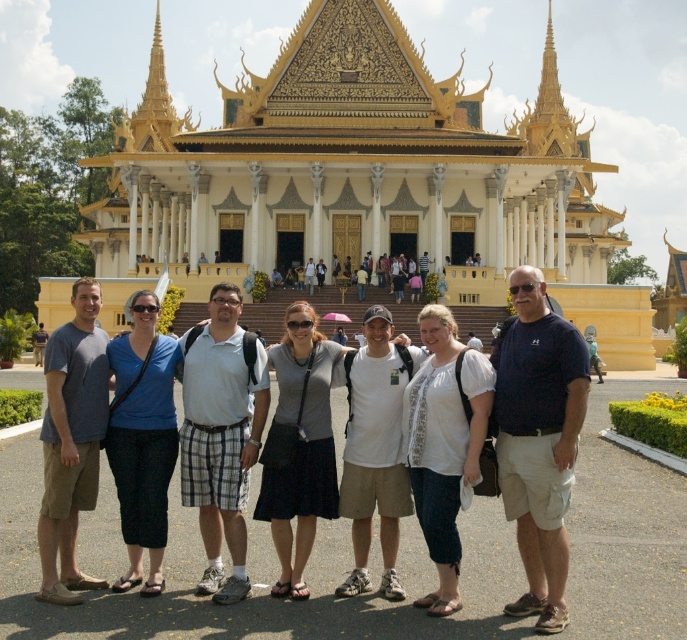
Does gold/golden/temple at center lie in front of matte blue shirt at center?

No, gold/golden/temple at center is behind matte blue shirt at center.

Measure the distance from gold/golden/temple at center to matte blue shirt at center.

gold/golden/temple at center and matte blue shirt at center are 60.02 meters apart.

Is point (172, 138) less distant than point (122, 364)?

No, (172, 138) is behind (122, 364).

This screenshot has height=640, width=687. I want to click on gold/golden/temple at center, so click(x=361, y=179).

Which is more to the right, gold/golden/temple at center or white cotton shirt at center?

From the viewer's perspective, white cotton shirt at center appears more on the right side.

Based on the photo, which of these two, gold/golden/temple at center or white cotton shirt at center, stands taller?

Standing taller between the two is gold/golden/temple at center.

I want to click on gold/golden/temple at center, so click(x=361, y=179).

The height and width of the screenshot is (640, 687). I want to click on gold/golden/temple at center, so click(361, 179).

Is white cotton shirt at center bigger than matte gray shirt at center?

No.

Is white cotton shirt at center smaller than matte gray shirt at center?

Yes, white cotton shirt at center is smaller than matte gray shirt at center.

Describe the element at coordinates (444, 444) in the screenshot. I see `white cotton shirt at center` at that location.

Where is `white cotton shirt at center`? This screenshot has height=640, width=687. white cotton shirt at center is located at coordinates (444, 444).